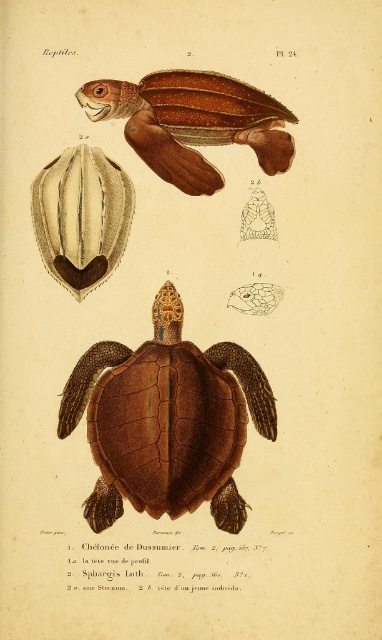
You are examining the turtle illustration and want to determine which of the two points, point (203,406) or point (166,115), is nearer to you. Based on the illustration, which point is closer?

Point (203,406) is closer to the viewer than point (166,115).